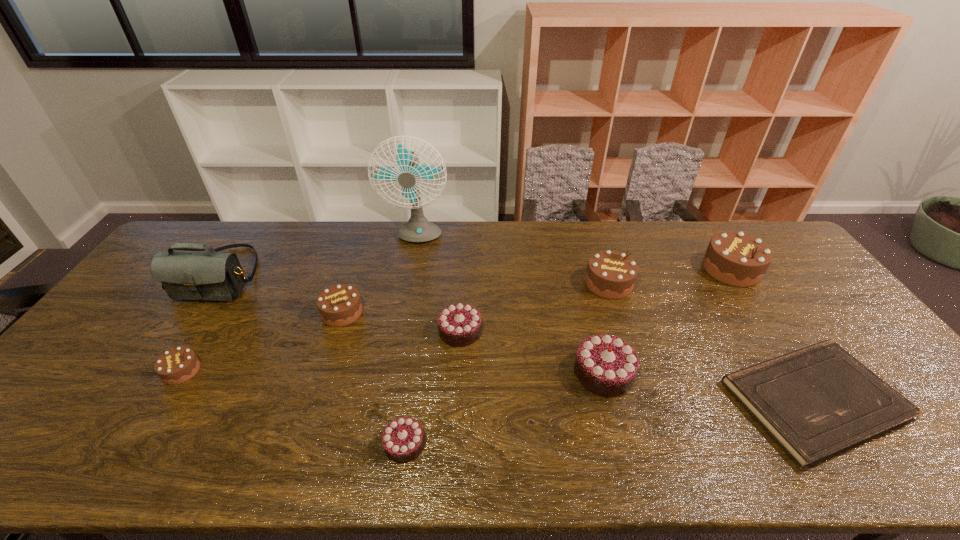
Identify the location of the tallest object. (418, 229).

Identify the location of gray fan. Image resolution: width=960 pixels, height=540 pixels. (418, 229).

In order to click on the ninth shortest object in this screenshot , I will do `click(218, 276)`.

I want to click on the rightmost chocolate cake, so tap(734, 258).

Find the location of a particular element. the biggest brown chocolate cake is located at coordinates (734, 258).

Identify the location of the sixth shortest chocolate cake. (610, 274).

This screenshot has height=540, width=960. I want to click on the third smallest brown chocolate cake, so click(x=610, y=274).

In order to click on the biggest chocolate chocolate cake in this screenshot , I will do `click(605, 365)`.

Image resolution: width=960 pixels, height=540 pixels. Find the location of `the rightmost chocolate chocolate cake`. the rightmost chocolate chocolate cake is located at coordinates (605, 365).

Locate an element on the screen. This screenshot has height=540, width=960. the second smallest brown chocolate cake is located at coordinates (339, 305).